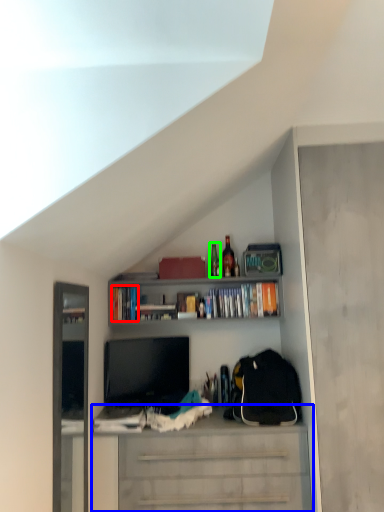
Question: Based on their relative distances, which object is farther from book (highlighted by a red box)? Choose from cabinetry (highlighted by a blue box) and bottle (highlighted by a green box).

Choices:
 (A) cabinetry
 (B) bottle

Answer: (A)